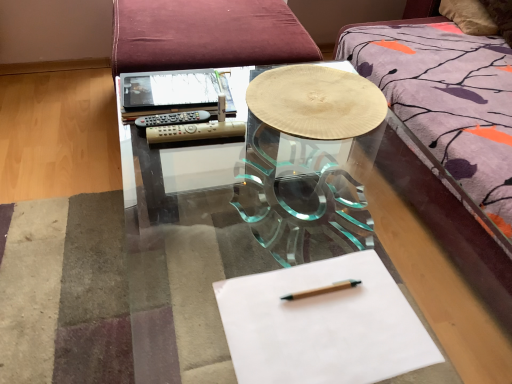
Question: In the image, is wooden textured plate at center on the left side or the right side of wooden pencil at center?

Choices:
 (A) left
 (B) right

Answer: (B)

Question: From the image's perspective, relative to wooden pencil at center, is wooden textured plate at center above or below?

Choices:
 (A) above
 (B) below

Answer: (A)

Question: Which object is positioned closest to the wooden pencil at center?

Choices:
 (A) matte black notebook at upper left
 (B) wooden textured plate at center
 (C) transparent glass table at center
 (D) white paper at center

Answer: (D)

Question: Estimate the real-world distances between objects in this image. Which object is farther from the matte black notebook at upper left?

Choices:
 (A) transparent glass table at center
 (B) wooden textured plate at center
 (C) wooden pencil at center
 (D) white paper at center

Answer: (C)